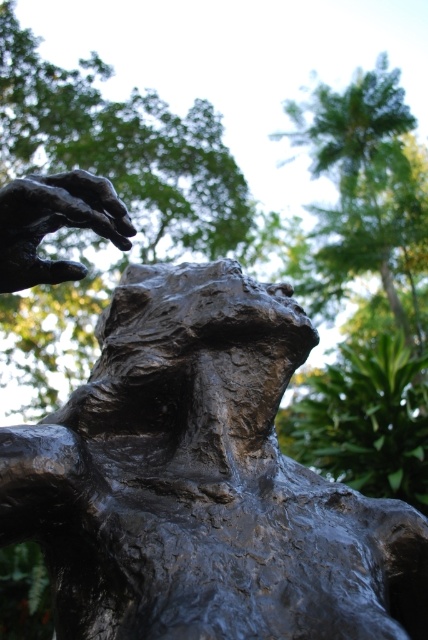
You are standing at the camera position and want to touch the point at coordinates (x=59, y=465) on the sculpture. If your arm can reach 30 inches, can you reach it without moving your feet?

The point at coordinates (x=59, y=465) is 27.75 inches away from the camera, so yes, you can reach it with your arm since it is within the 30 inches range.

You are a photographer adjusting your camera settings to focus on the bronze sculpture at center. The camera has a focus point at coordinate point (202,483). Will this point help you focus on the bronze sculpture at center?

The point (202,483) corresponds to the bronze sculpture at center, so yes, this focus point will help you focus on the bronze sculpture at center.

You are a photographer standing 3 feet away from the bronze sculpture at center. You want to take a closeup shot of the sculpture. Is your current distance sufficient to capture the sculpture in focus without moving closer?

The bronze sculpture at center is 22.87 inches from viewer. Since 3 feet equals 36 inches, which is farther than 22.87 inches, you are already closer than the required distance. Therefore, your current distance is sufficient to capture the sculpture in focus without moving closer.